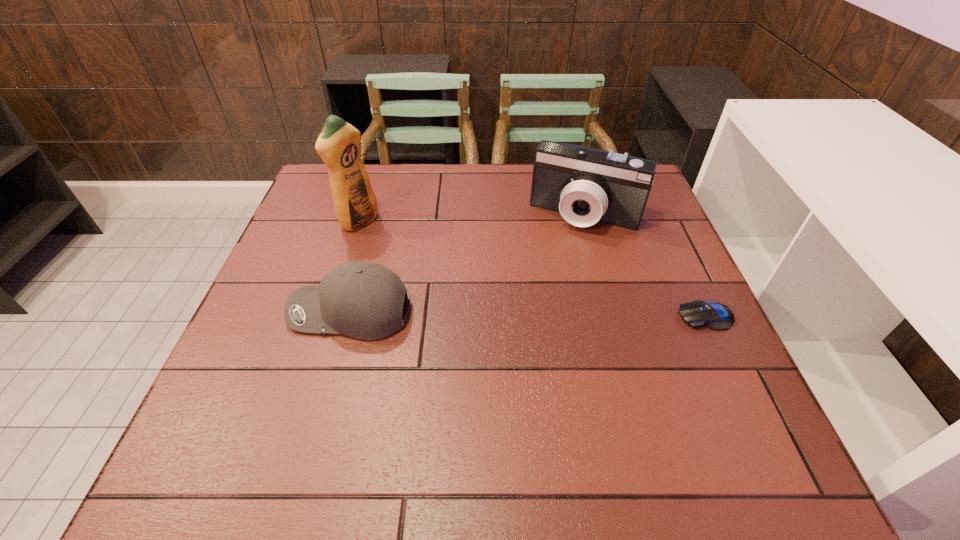
This screenshot has height=540, width=960. Identify the location of vacant region located on the lens of the camcorder. (537, 311).

Image resolution: width=960 pixels, height=540 pixels. What are the coordinates of `blank space located 0.270m on the lens of the camcorder` in the screenshot? It's located at click(x=539, y=308).

The height and width of the screenshot is (540, 960). I want to click on blank space located on the label of the tallest object, so click(x=485, y=289).

The width and height of the screenshot is (960, 540). In order to click on vacant space located on the label of the tallest object in this screenshot , I will do `click(414, 251)`.

Identify the location of free spot located 0.140m on the label of the tallest object. The image size is (960, 540). (411, 249).

Locate an element on the screen. This screenshot has height=540, width=960. object that is at the far edge is located at coordinates (585, 185).

Identify the location of baseball cap at the left edge. (362, 300).

Locate an element on the screen. detergent present at the left edge is located at coordinates [x=339, y=144].

Where is `computer mouse positioned at the right edge`? computer mouse positioned at the right edge is located at coordinates (699, 313).

Find the location of a particular element. camcorder located in the right edge section of the desktop is located at coordinates (585, 185).